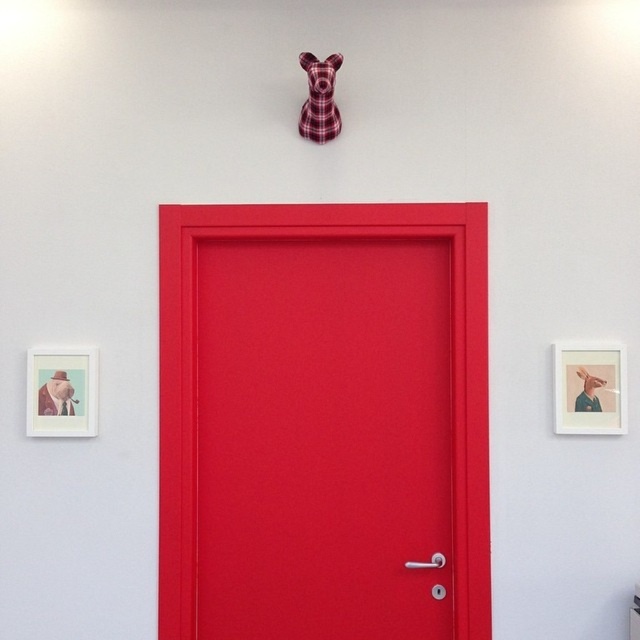
You are standing in front of the bold red door and want to take a photo of the matte white picture frame at lower left. If your camera has a maximum focus range of 9 feet, will it be able to capture the frame clearly?

The matte white picture frame at lower left and camera are 9.07 feet apart, which exceeds the camera maximum focus range of 9 feet. Therefore, the camera cannot capture the frame clearly.

You are an interior designer assessing the space. The client wants to know if the plaid fabric dog at upper center can be moved to the right side of the matte red door at center without overlapping. Can you confirm if there is enough space?

The matte red door at center is bigger than the plaid fabric dog at upper center, so there should be sufficient space to move the plaid fabric dog at upper center to the right side of the matte red door at center without overlapping.

You are standing in front of the red door and want to hang a new picture. The existing matte white picture frame at lower left is currently at coordinates point 0.613, 0.097. If you want to place a new picture directly to the right of this frame, where should you position it?

To place the new picture directly to the right of the matte white picture frame at lower left, you should position it at coordinates point (x=61, y=392). However, since the existing frame is already at that location, you would need to adjust the coordinates slightly to the right, perhaps to point (x=61, y=396), ensuring there is enough space between them.